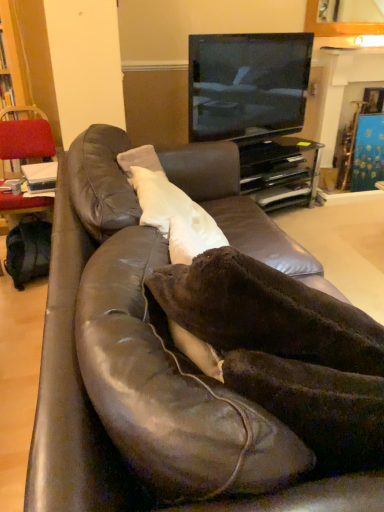
Question: Does brown leather couch at center have a lesser height compared to black glossy entertainment center at upper center?

Choices:
 (A) yes
 (B) no

Answer: (B)

Question: From the image's perspective, is brown leather couch at center located beneath black glossy entertainment center at upper center?

Choices:
 (A) no
 (B) yes

Answer: (B)

Question: Is brown leather couch at center looking in the opposite direction of black glossy entertainment center at upper center?

Choices:
 (A) yes
 (B) no

Answer: (B)

Question: Is brown leather couch at center to the left of black glossy entertainment center at upper center from the viewer's perspective?

Choices:
 (A) no
 (B) yes

Answer: (B)

Question: Is brown leather couch at center closer to camera compared to black glossy entertainment center at upper center?

Choices:
 (A) yes
 (B) no

Answer: (A)

Question: From the image's perspective, is brown leather couch at center on top of black glossy entertainment center at upper center?

Choices:
 (A) no
 (B) yes

Answer: (A)

Question: From a real-world perspective, is black glossy entertainment center at upper center beneath white soft pillow at center?

Choices:
 (A) yes
 (B) no

Answer: (A)

Question: Can you confirm if black glossy entertainment center at upper center is positioned to the left of white soft pillow at center?

Choices:
 (A) no
 (B) yes

Answer: (A)

Question: Considering the relative sizes of black glossy entertainment center at upper center and white soft pillow at center in the image provided, is black glossy entertainment center at upper center taller than white soft pillow at center?

Choices:
 (A) yes
 (B) no

Answer: (A)

Question: Is black glossy entertainment center at upper center not inside white soft pillow at center?

Choices:
 (A) yes
 (B) no

Answer: (A)

Question: Is black glossy entertainment center at upper center smaller than white soft pillow at center?

Choices:
 (A) no
 (B) yes

Answer: (A)

Question: From a real-world perspective, is black glossy entertainment center at upper center positioned over white soft pillow at center based on gravity?

Choices:
 (A) no
 (B) yes

Answer: (A)

Question: From a real-world perspective, does metallic gold fireplace at upper center sit lower than brown leather couch at center?

Choices:
 (A) no
 (B) yes

Answer: (A)